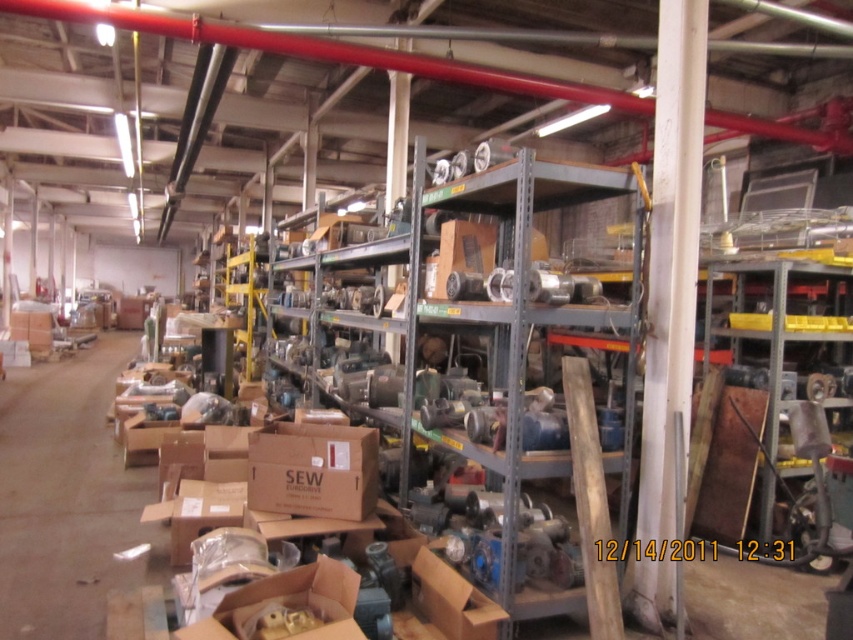
Which is more to the right, metallic gray shelf at center or brown cardboard box at center?

Positioned to the right is metallic gray shelf at center.

The height and width of the screenshot is (640, 853). What are the coordinates of `metallic gray shelf at center` in the screenshot? It's located at (540, 314).

The width and height of the screenshot is (853, 640). What do you see at coordinates (540, 314) in the screenshot? I see `metallic gray shelf at center` at bounding box center [540, 314].

Locate an element on the screen. Image resolution: width=853 pixels, height=640 pixels. metallic gray shelf at center is located at coordinates (540, 314).

Does white painted wood at right have a smaller size compared to brown cardboard box at center?

No.

Does white painted wood at right lie behind brown cardboard box at center?

No, white painted wood at right is in front of brown cardboard box at center.

Who is more distant from viewer, (680, 618) or (271, 476)?

The point (271, 476) is more distant.

The width and height of the screenshot is (853, 640). Identify the location of white painted wood at right. (671, 257).

Between white painted wood at right and metallic gray shelf at center, which one appears on the right side from the viewer's perspective?

white painted wood at right is more to the right.

Between point (665, 568) and point (506, 365), which one is positioned behind?

Point (506, 365)

Where is `white painted wood at right`? The width and height of the screenshot is (853, 640). white painted wood at right is located at coordinates (671, 257).